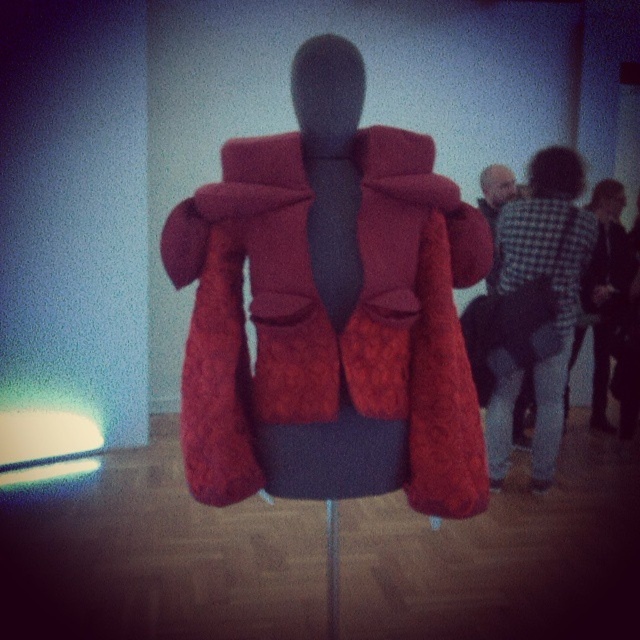
You are standing in the gallery and want to touch the point at coordinates point (429, 216) on the mannequin. If your arm can reach 4 feet, will you be able to reach it?

The point (429, 216) is 4.50 feet away from you, so your arm can only reach 4 feet. Therefore, you cannot reach the point (429, 216) with your current arm length.

You are a fashion designer assessing the display in the gallery. You need to determine which garment is shorter between the velvet red coat at center and the black checkered shirt at upper right. Which one is shorter?

The velvet red coat at center is shorter than the black checkered shirt at upper right.

You are an assistant helping a customer in a clothing store. The customer wants to try on the velvet red coat at center and the checkered fabric shirt at center. However, the coat is currently blocking the shirt. Can you tell the customer which item they should remove first to access the other?

The velvet red coat at center is in front of checkered fabric shirt at center, so the customer should remove the velvet red coat at center first to access the checkered fabric shirt at center.